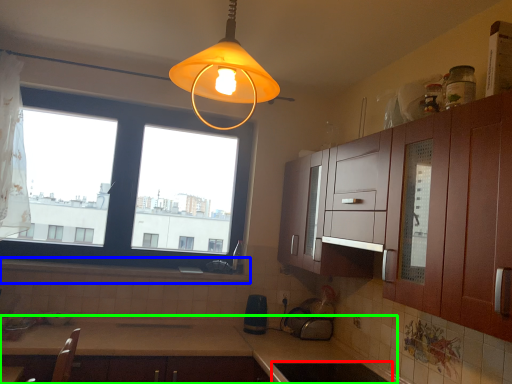
Question: Considering the real-world distances, which object is closest to appliance (highlighted by a red box)? window sill (highlighted by a blue box) or countertop (highlighted by a green box).

Choices:
 (A) window sill
 (B) countertop

Answer: (B)